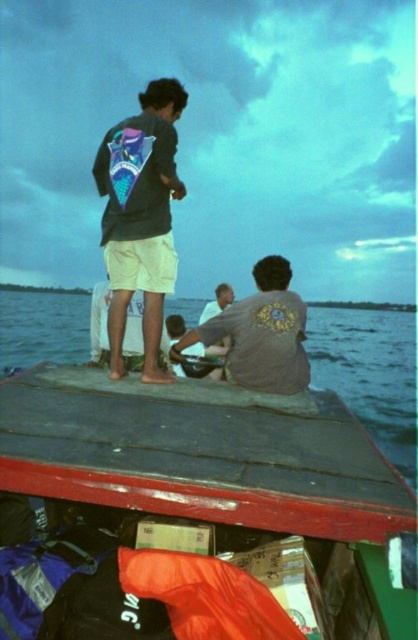
Between point (25, 316) and point (185, 346), which one is positioned behind?

The point (25, 316) is more distant.

Does blue water at center appear on the left side of gray matte shirt at center?

Incorrect, blue water at center is not on the left side of gray matte shirt at center.

At what (x,y) coordinates should I click in order to perform the action: click on blue water at center. Please return your answer as a coordinate pair (x, y). This screenshot has height=640, width=418. Looking at the image, I should click on (369, 372).

Which is more to the right, smooth wooden boat at center or matte gray shirt at center?

Positioned to the right is matte gray shirt at center.

This screenshot has height=640, width=418. What do you see at coordinates (196, 513) in the screenshot?
I see `smooth wooden boat at center` at bounding box center [196, 513].

Who is more forward, (219, 624) or (216, 310)?

Point (219, 624) is more forward.

The width and height of the screenshot is (418, 640). What are the coordinates of `smooth wooden boat at center` in the screenshot? It's located at (196, 513).

Can you confirm if blue water at center is shorter than matte black jacket at upper center?

No, blue water at center is not shorter than matte black jacket at upper center.

Can you confirm if blue water at center is wider than matte black jacket at upper center?

Yes, blue water at center is wider than matte black jacket at upper center.

This screenshot has height=640, width=418. What do you see at coordinates (369, 372) in the screenshot?
I see `blue water at center` at bounding box center [369, 372].

At what (x,y) coordinates should I click in order to perform the action: click on blue water at center. Please return your answer as a coordinate pair (x, y). This screenshot has height=640, width=418. Looking at the image, I should click on (369, 372).